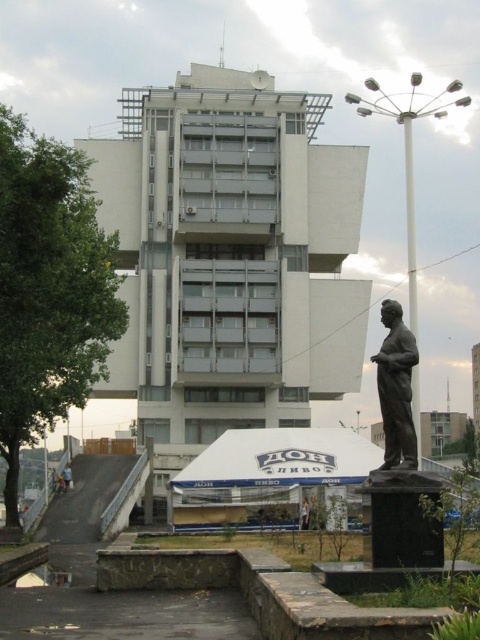
Measure the distance between bronze statue at right and metallic helmet at lower left.

bronze statue at right is 43.05 meters away from metallic helmet at lower left.

From the picture: Does bronze statue at right appear over metallic helmet at lower left?

Indeed, bronze statue at right is positioned over metallic helmet at lower left.

Who is more forward, (386, 438) or (61, 472)?

Point (386, 438)

Find the location of a particular element. This screenshot has height=640, width=480. bronze statue at right is located at coordinates (396, 388).

Is bronze statue at right bigger than light brown wooden bench at lower center?

Yes, bronze statue at right is bigger than light brown wooden bench at lower center.

Is bronze statue at right smaller than light brown wooden bench at lower center?

No.

Who is more distant from viewer, (x=398, y=417) or (x=301, y=515)?

The point (x=301, y=515) is more distant.

This screenshot has height=640, width=480. Identify the location of bronze statue at right. (396, 388).

Does point (305, 520) come farther from viewer compared to point (62, 472)?

No, (305, 520) is closer to viewer.

Between point (307, 528) and point (67, 467), which one is positioned behind?

Point (67, 467)

Which is behind, point (304, 499) or point (71, 472)?

Point (71, 472)

You are a GUI agent. You are given a task and a screenshot of the screen. Output one action in this format:
    pyautogui.click(x=<x>, y=<y>)
    Task: Click on the light brown wooden bench at lower center
    This screenshot has height=640, width=480.
    Given the screenshot: What is the action you would take?
    pyautogui.click(x=303, y=515)